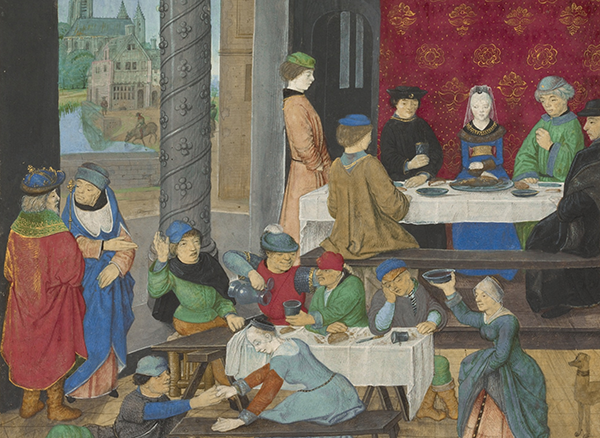
You are a GUI agent. You are given a task and a screenshot of the screen. Output one action in this format:
    pyautogui.click(x=<x>, y=<y>)
    Task: Click on the table
    
    Given the screenshot: What is the action you would take?
    pyautogui.click(x=481, y=206), pyautogui.click(x=322, y=347), pyautogui.click(x=314, y=423)